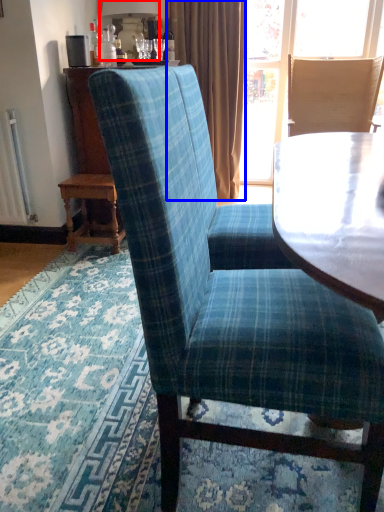
Question: Which of the following is the farthest to the observer, lamp (highlighted by a red box) or curtain (highlighted by a blue box)?

Choices:
 (A) lamp
 (B) curtain

Answer: (B)